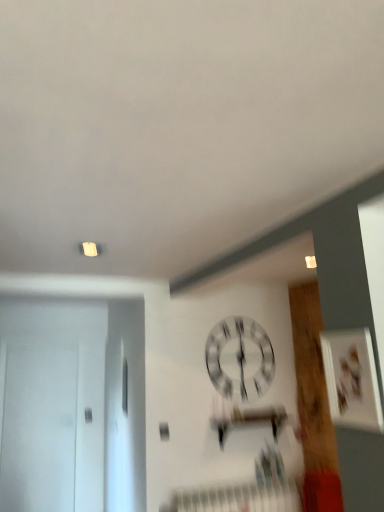
This screenshot has height=512, width=384. Describe the element at coordinates (52, 405) in the screenshot. I see `white matte door at left` at that location.

Where is `white matte door at left`? Image resolution: width=384 pixels, height=512 pixels. white matte door at left is located at coordinates (52, 405).

Locate an element on the screen. The width and height of the screenshot is (384, 512). white glossy clock at center is located at coordinates (240, 359).

This screenshot has height=512, width=384. Describe the element at coordinates (240, 359) in the screenshot. I see `white glossy clock at center` at that location.

The width and height of the screenshot is (384, 512). I want to click on white matte door at left, so click(52, 405).

Is white matte door at left to the right of white glossy clock at center from the viewer's perspective?

Incorrect, white matte door at left is not on the right side of white glossy clock at center.

Who is more distant, white matte door at left or white glossy clock at center?

white matte door at left is more distant.

Is point (9, 298) positioned in front of point (241, 352)?

No, (9, 298) is further to viewer.

From the image's perspective, is white matte door at left located beneath white glossy clock at center?

Indeed, from the image's perspective, white matte door at left is shown beneath white glossy clock at center.

From a real-world perspective, is white matte door at left physically below white glossy clock at center?

Correct, in the physical world, white matte door at left is lower than white glossy clock at center.

Is white matte door at left thinner than white glossy clock at center?

Incorrect, the width of white matte door at left is not less than that of white glossy clock at center.

Consider the image. Between white matte door at left and white glossy clock at center, which one has less height?

white glossy clock at center is shorter.

Considering the sizes of white matte door at left and white glossy clock at center in the image, is white matte door at left bigger or smaller than white glossy clock at center?

In the image, white matte door at left appears to be larger than white glossy clock at center.

Would you say white matte door at left is inside or outside white glossy clock at center?

white matte door at left is outside white glossy clock at center.

Can you see white matte door at left touching white glossy clock at center?

white matte door at left and white glossy clock at center are not in contact.

Does white matte door at left turn towards white glossy clock at center?

No, white matte door at left is not turned towards white glossy clock at center.

What's the angular difference between white matte door at left and white glossy clock at center's facing directions?

0.61 degrees separate the facing orientations of white matte door at left and white glossy clock at center.

Measure the distance from white matte door at left to white glossy clock at center.

A distance of 1.97 meters exists between white matte door at left and white glossy clock at center.

Find the location of a particular element. Image resolution: width=384 pixels, height=512 pixels. wall clock located in front of the white matte door at left is located at coordinates (240, 359).

Which object is positioned more to the left, white glossy clock at center or white matte door at left?

white matte door at left is more to the left.

Which object is closer to the camera, white glossy clock at center or white matte door at left?

white glossy clock at center is more forward.

Which is less distant, [239,328] or [56,423]?

The point [239,328] is more forward.

From the image's perspective, which is below, white glossy clock at center or white matte door at left?

white matte door at left.

From the picture: From a real-world perspective, does white glossy clock at center sit lower than white matte door at left?

No.

Looking at this image, which object is thinner, white glossy clock at center or white matte door at left?

white glossy clock at center is thinner.

Is white glossy clock at center shorter than white matte door at left?

Indeed, white glossy clock at center has a lesser height compared to white matte door at left.

Can you confirm if white glossy clock at center is bigger than white matte door at left?

No.

Is white matte door at left located within white glossy clock at center?

Actually, white matte door at left is outside white glossy clock at center.

Is the surface of white glossy clock at center in direct contact with white matte door at left?

No, white glossy clock at center is not touching white matte door at left.

Is white glossy clock at center oriented away from white matte door at left?

That's not correct — white glossy clock at center is not looking away from white matte door at left.

Can you tell me how much white glossy clock at center and white matte door at left differ in facing direction?

0.61 degrees.

Find the location of a particular element. The width and height of the screenshot is (384, 512). wall clock above the white matte door at left (from the image's perspective) is located at coordinates (240, 359).

Locate an element on the screen. Image resolution: width=384 pixels, height=512 pixels. wall clock that is in front of the white matte door at left is located at coordinates (240, 359).

Locate an element on the screen. Image resolution: width=384 pixels, height=512 pixels. wall clock above the white matte door at left (from a real-world perspective) is located at coordinates (240, 359).